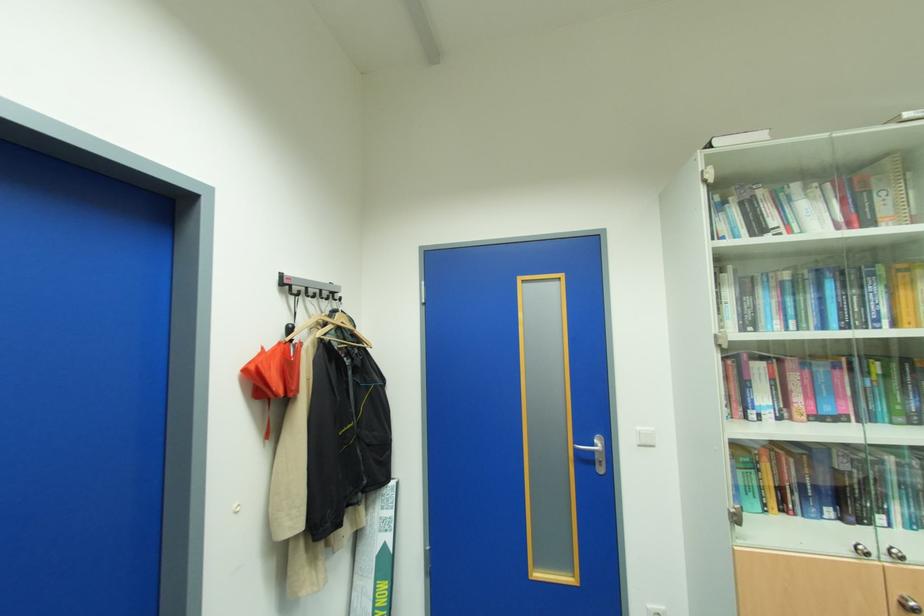
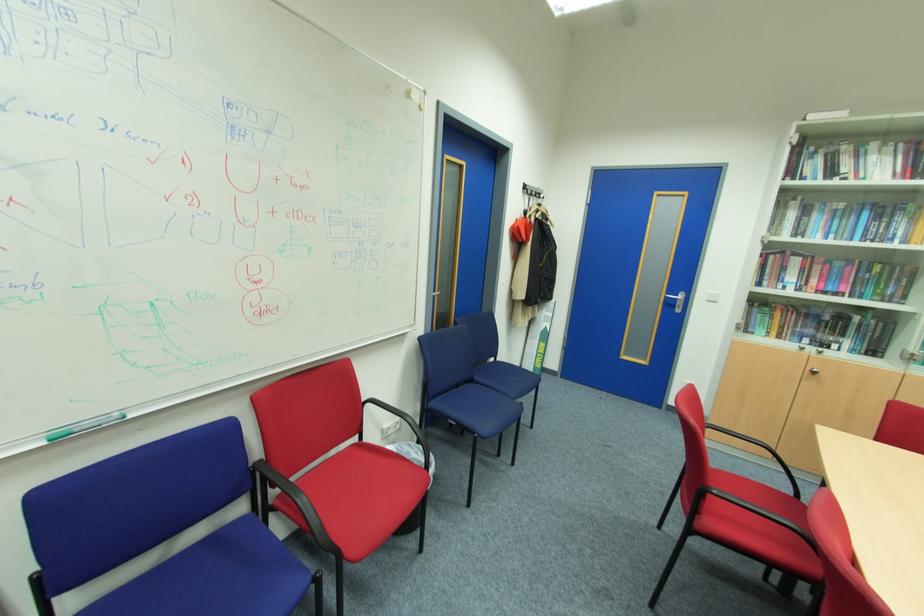
The point at (829, 326) is marked in the first image. Where is the corresponding point in the second image?

(854, 240)